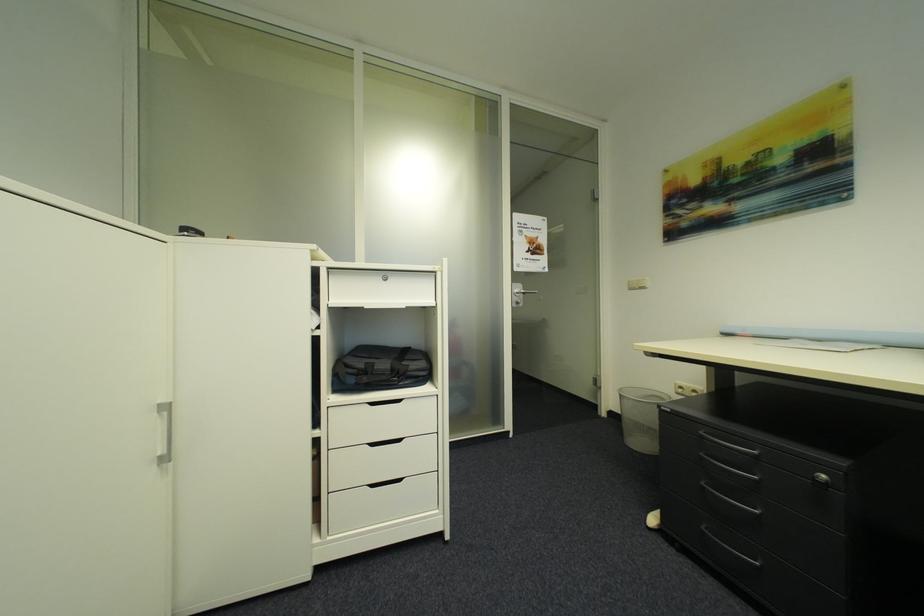
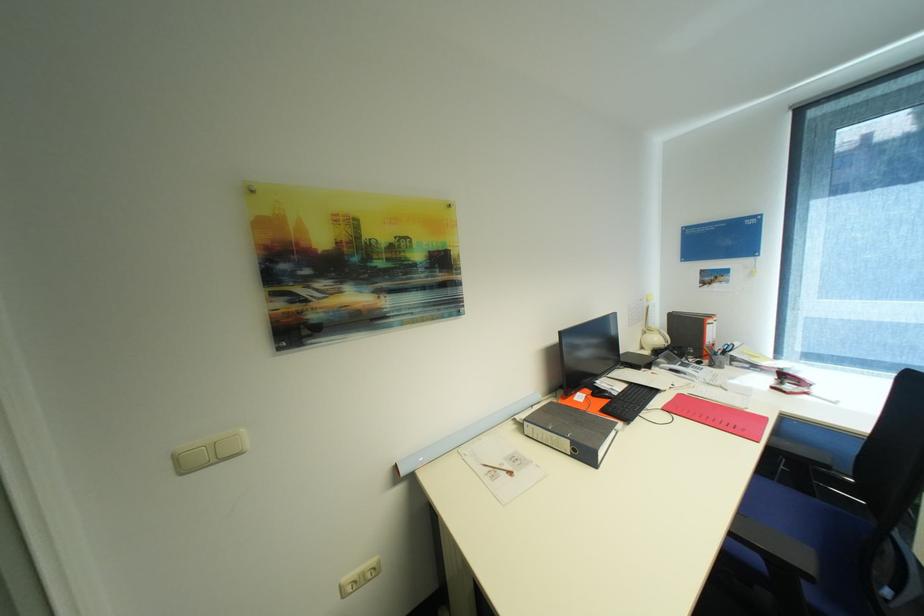
In the second image, find the point that corresponds to the point at 637,284 in the first image.

(185, 458)